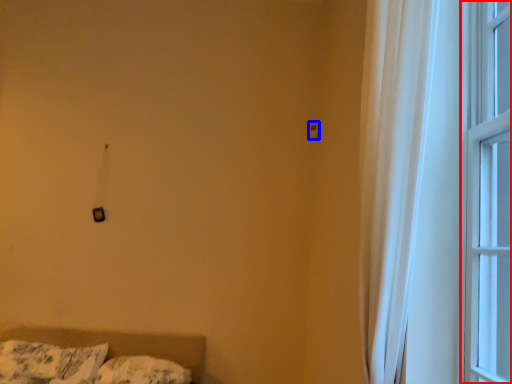
Question: Which object appears closest to the camera in this image, window (highlighted by a red box) or light switch (highlighted by a blue box)?

Choices:
 (A) window
 (B) light switch

Answer: (A)